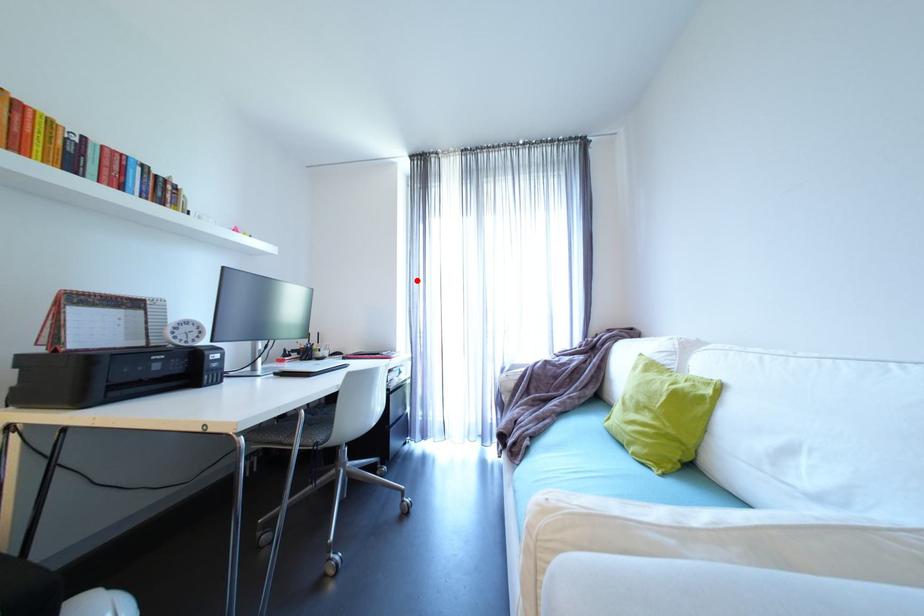
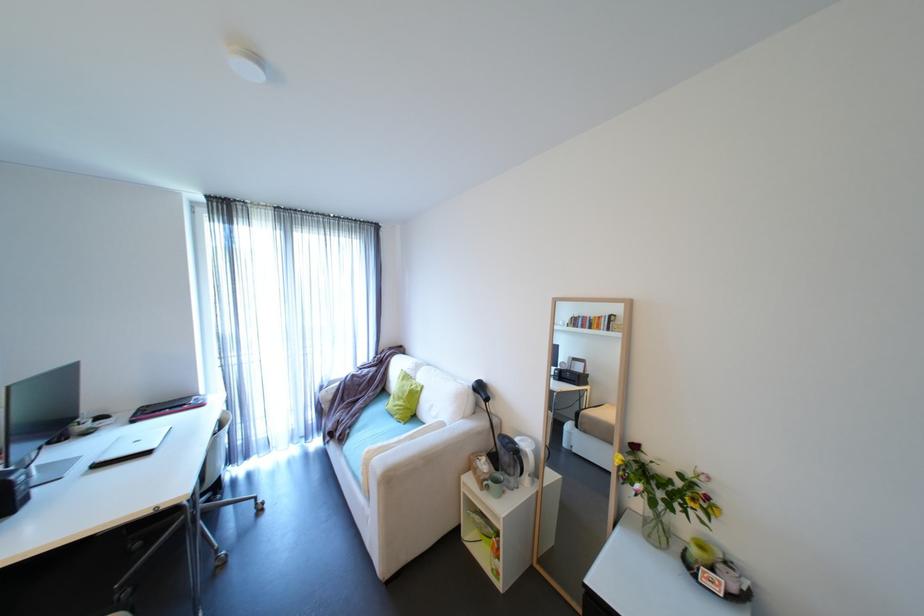
Where in the second image is the point corresponding to the highlighted location from the first image?

(225, 326)